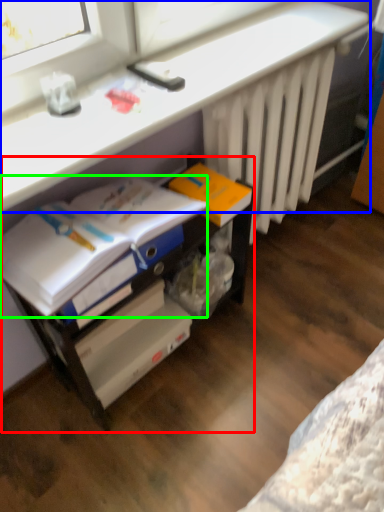
Question: Which object is positioned closest to file cabinet (highlighted by a red box)? Select from computer (highlighted by a blue box) and magazine (highlighted by a green box).

Choices:
 (A) computer
 (B) magazine

Answer: (B)